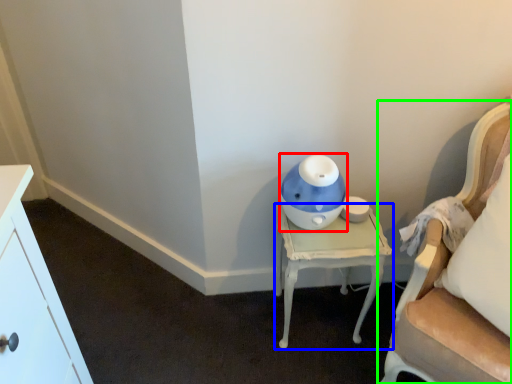
Question: Based on their relative distances, which object is nearer to toy (highlighted by a red box)? Choose from nightstand (highlighted by a blue box) and chair (highlighted by a green box).

Choices:
 (A) nightstand
 (B) chair

Answer: (A)